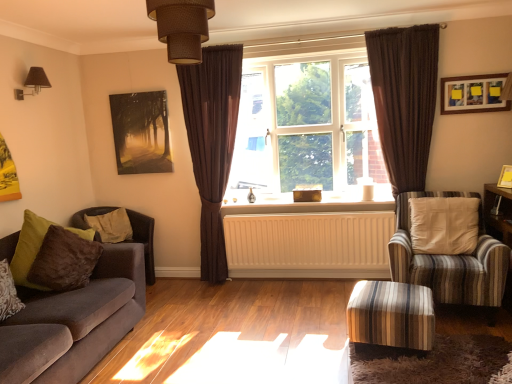
This screenshot has height=384, width=512. In order to click on vacant region above matte black painting at upper left, arranged as the 3th picture frame when viewed from the right (from a real-world perspective) in this screenshot , I will do `click(134, 91)`.